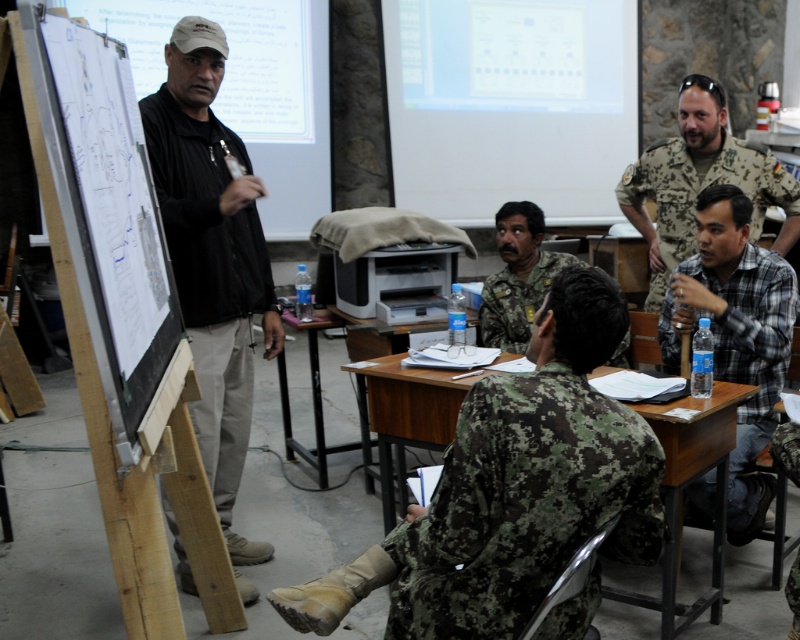
Question: Which of the following is the farthest from the observer?

Choices:
 (A) (120, 358)
 (B) (786, 326)
 (C) (198, 328)
 (D) (390, 477)

Answer: (D)

Question: Estimate the real-world distances between objects in this image. Which object is closer to the camouflage uniform at center?

Choices:
 (A) black matte jacket at left
 (B) wooden desk at lower center

Answer: (B)

Question: Is camouflage fabric shirt at right positioned at the back of camouflage uniform at center?

Choices:
 (A) no
 (B) yes

Answer: (A)

Question: Which of the following is the farthest from the observer?

Choices:
 (A) (504, 296)
 (B) (422, 422)
 (C) (748, 518)
 (D) (192, 561)

Answer: (A)

Question: Is plaid cotton shirt at center wider than camouflage fabric shirt at right?

Choices:
 (A) no
 (B) yes

Answer: (A)

Question: Can you confirm if wooden desk at lower center is positioned to the left of camouflage uniform at center?

Choices:
 (A) yes
 (B) no

Answer: (B)